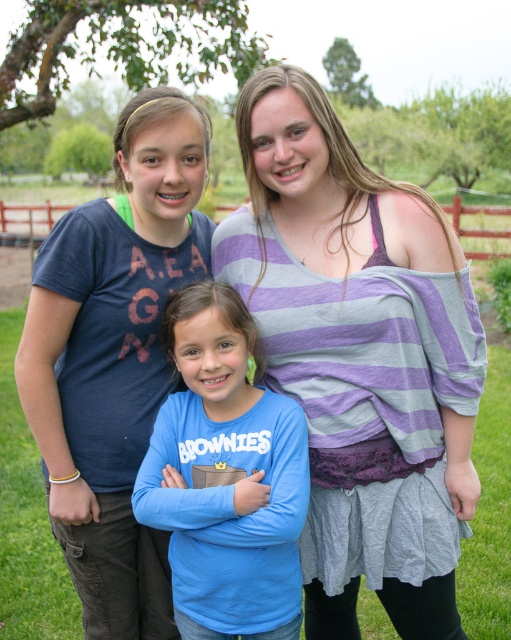
Does striped fabric top at center have a greater height compared to blue cotton shirt at center?

Yes, striped fabric top at center is taller than blue cotton shirt at center.

Can you confirm if striped fabric top at center is positioned above blue cotton shirt at center?

Indeed, striped fabric top at center is positioned over blue cotton shirt at center.

Locate an element on the screen. striped fabric top at center is located at coordinates (360, 356).